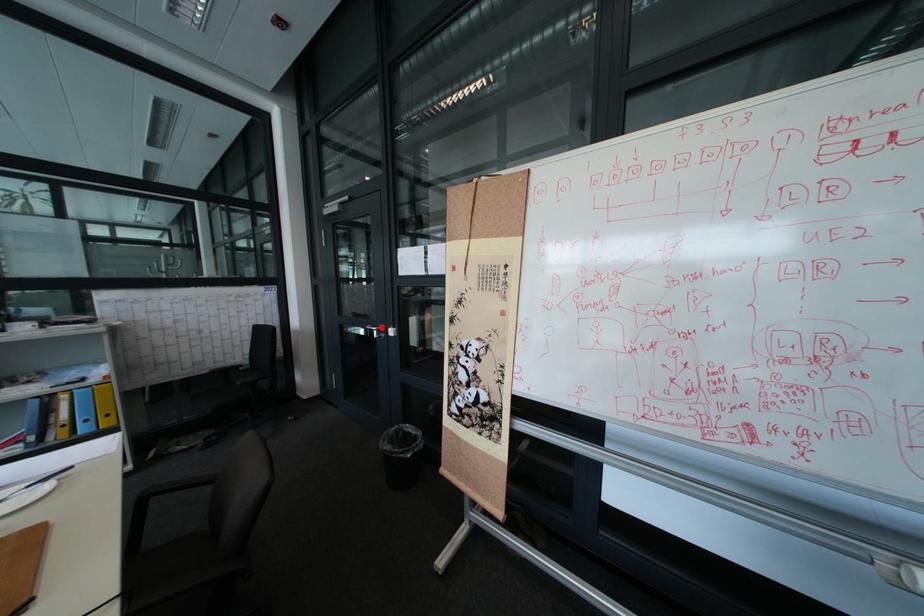
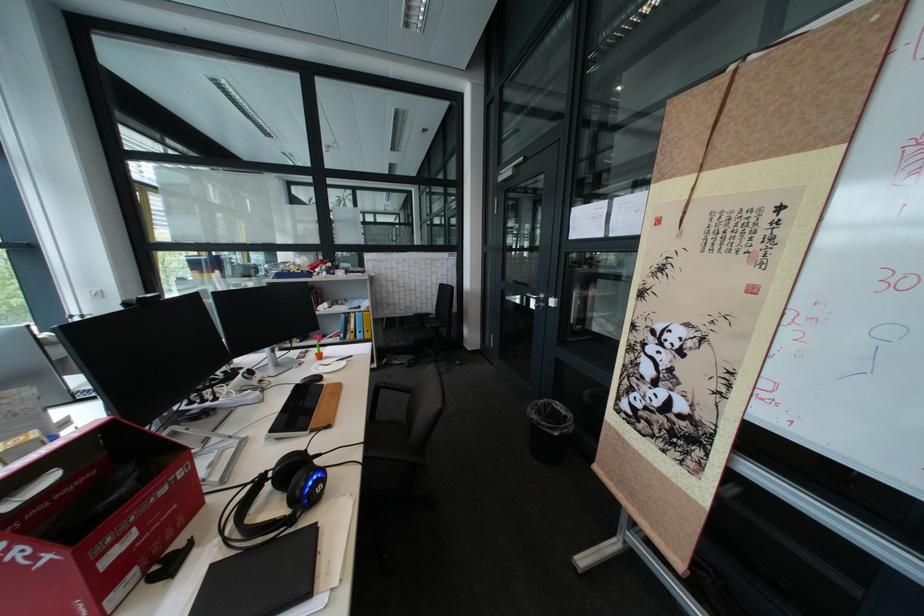
The point at the highlighted location is marked in the first image. Where is the corresponding point in the second image?

(541, 294)